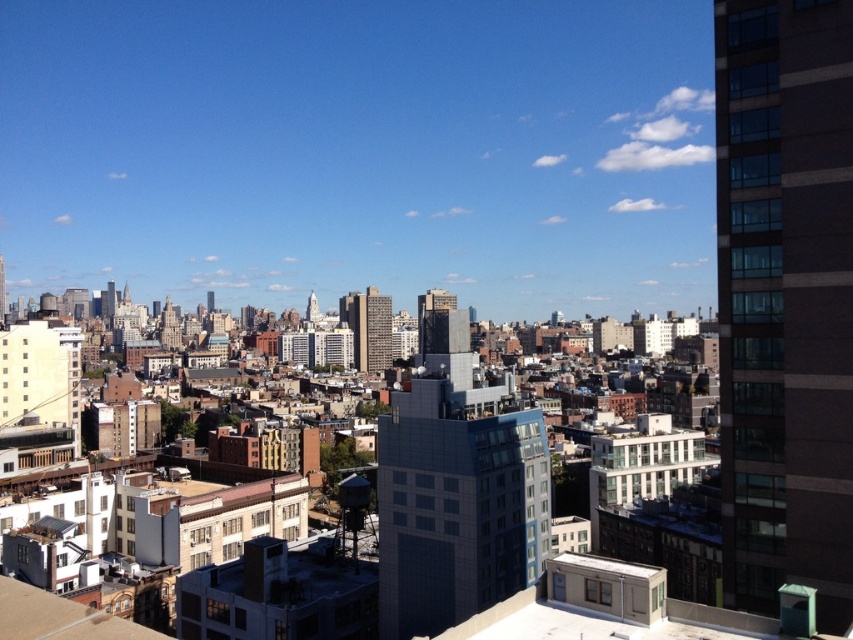
From the picture: You are a city planner assessing the potential for a new communication tower to be built between the glassy reflective building at right and the matte gray building at center. Given that the minimum required distance between existing buildings and the new tower must be at least 300 meters, can the proposed tower be placed between them?

The distance between the glassy reflective building at right and the matte gray building at center is 317.05 meters. Since this distance exceeds the minimum required 300 meters, the proposed communication tower can be placed between them as it satisfies the spacing requirement.

You are an urban planner analyzing the cityscape. You need to determine which of the two buildings, the blue glass building at center or the smooth concrete skyscraper at center, occupies more space in the urban layout. Based on the provided information, which building would you identify as having a greater footprint?

The blue glass building at center has a larger size compared to the smooth concrete skyscraper at center, so it occupies more space in the urban layout.

You are an urban planner reviewing this cityscape. You need to determine the spatial relationship between the glassy reflective building at right and the blue glass building at center. Which building is located to the east if the sun is setting in the west and both buildings cast shadows to the east?

The glassy reflective building at right is positioned on the right side of the blue glass building at center. Since the sun is setting in the west, shadows are cast to the east. If the glassy reflective building at right is to the right of the blue glass building at center, then the blue glass building at center is east of the glassy reflective building at right. Therefore, the blue glass building at center is located to the east.